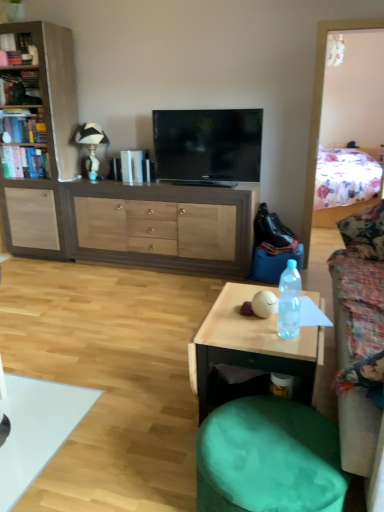
Identify the location of free location above green fabric swivel chair at lower right (from a real-world perspective). (271, 442).